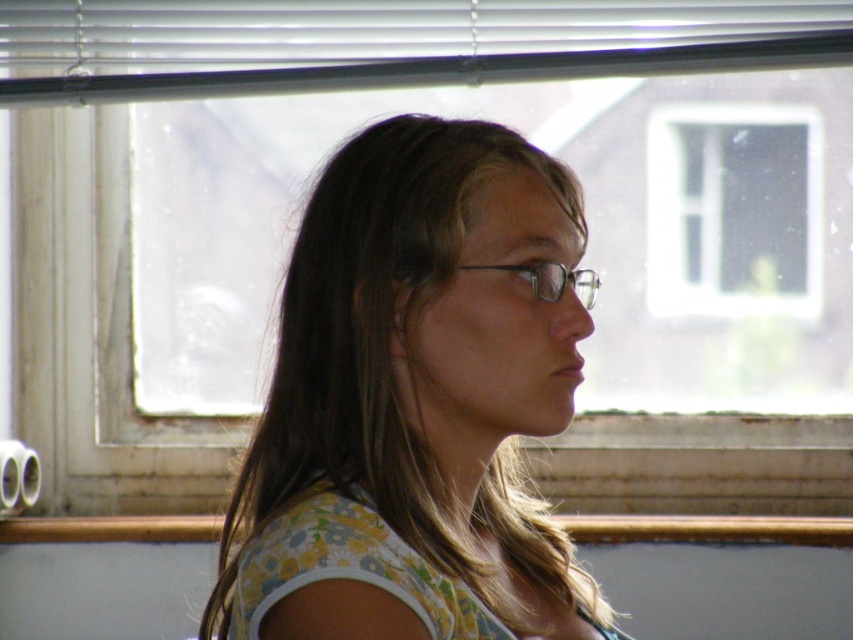
Between transparent glass window at upper center and clear plastic glasses at center, which one has more height?

With more height is transparent glass window at upper center.

Is point (692, 189) less distant than point (558, 289)?

No, it is not.

Is point (757, 252) positioned behind point (569, 282)?

That is True.

The width and height of the screenshot is (853, 640). I want to click on transparent glass window at upper center, so click(734, 211).

Can you confirm if white plastic blinds at upper center is positioned above clear plastic glasses at center?

Correct, white plastic blinds at upper center is located above clear plastic glasses at center.

Who is more distant from viewer, (364, 19) or (573, 280)?

Positioned behind is point (364, 19).

Where is `white plastic blinds at upper center`? white plastic blinds at upper center is located at coordinates (392, 42).

Can you confirm if floral fabric shirt at center is positioned to the left of white plastic blinds at upper center?

No, floral fabric shirt at center is not to the left of white plastic blinds at upper center.

Is floral fabric shirt at center smaller than white plastic blinds at upper center?

No.

Is point (410, 317) in front of point (781, 10)?

Yes.

Locate an element on the screen. floral fabric shirt at center is located at coordinates (415, 403).